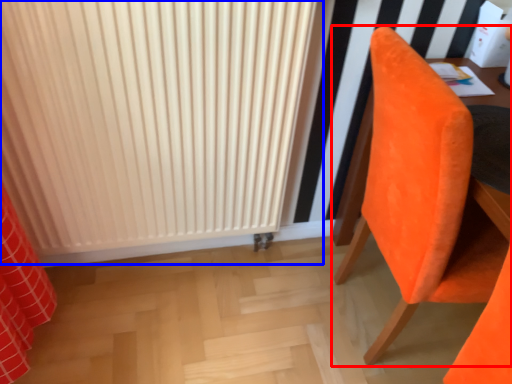
Question: Which object appears farthest to the camera in this image, chair (highlighted by a red box) or radiator (highlighted by a blue box)?

Choices:
 (A) chair
 (B) radiator

Answer: (B)